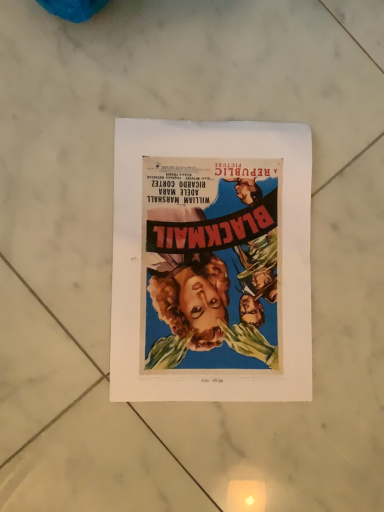
Identify the location of vacant region above matte paper poster at center (from a real-world perspective). (209, 252).